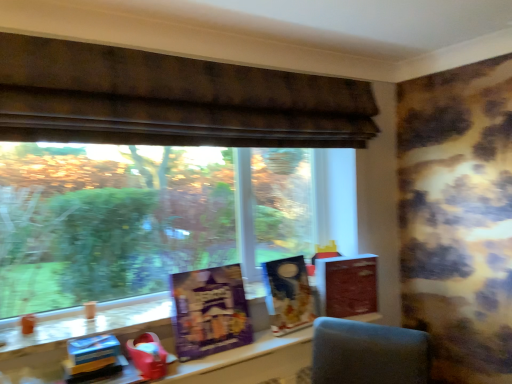
Question: Relative to brown textured fabric at upper center, is purple matte board game at center, which ranks as the second paperback book in back-to-front order, in front or behind?

Choices:
 (A) behind
 (B) front

Answer: (A)

Question: From a real-world perspective, is purple matte board game at center, positioned as the second paperback book in right-to-left order, physically located above or below brown textured fabric at upper center?

Choices:
 (A) below
 (B) above

Answer: (A)

Question: Which is farther from the brown textured fabric at upper center?

Choices:
 (A) matte plastic table at center
 (B) matte black book at center
 (C) blue cardboard box at lower left, placed as the 1th toy when sorted from left to right
 (D) shiny red toy at lower left, arranged as the 1th toy when viewed from the right
 (E) purple matte board game at center, which appears as the 1th paperback book when viewed from the left

Answer: (A)

Question: Which object is positioned farthest from the matte plastic table at center?

Choices:
 (A) purple matte board game at center, which appears as the 1th paperback book when viewed from the left
 (B) brown textured fabric at upper center
 (C) blue cardboard box at lower left, which ranks as the 2th toy in right-to-left order
 (D) shiny red toy at lower left, arranged as the 1th toy when viewed from the right
 (E) matte brown book at right, the second paperback book from the front

Answer: (B)